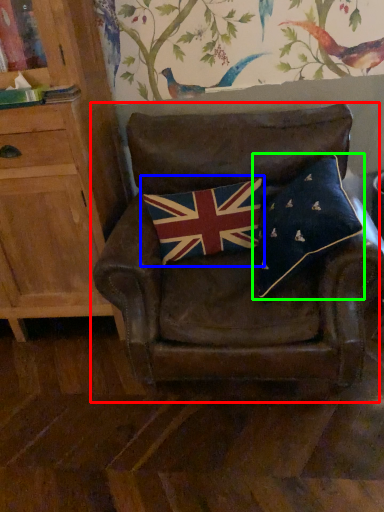
Question: Based on their relative distances, which object is nearer to chair (highlighted by a red box)? Choose from flag (highlighted by a blue box) and pillow (highlighted by a green box).

Choices:
 (A) flag
 (B) pillow

Answer: (A)